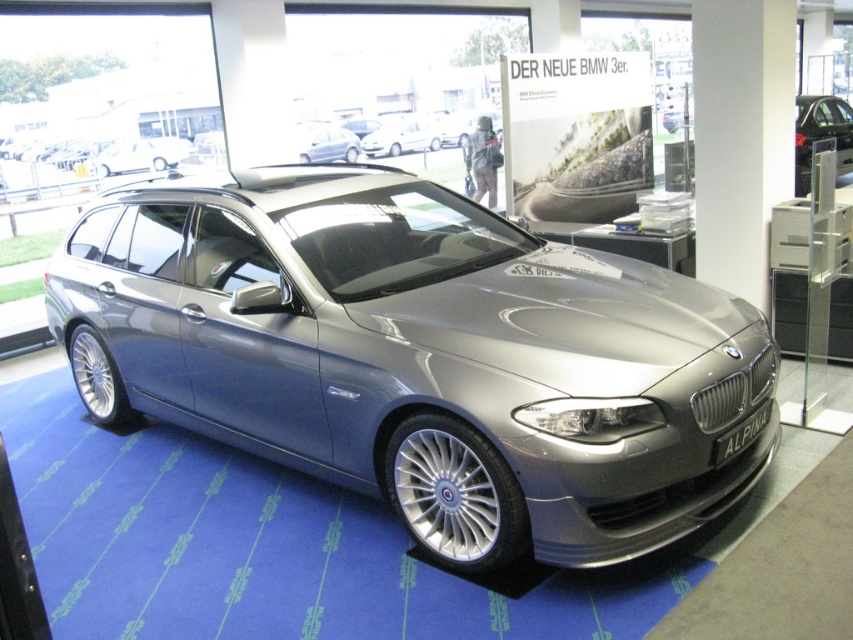
Question: Is white glossy car at center bigger than white glossy hatchback at center?

Choices:
 (A) no
 (B) yes

Answer: (A)

Question: Observing the image, what is the correct spatial positioning of blue carpet at center in reference to satin silver car at upper right?

Choices:
 (A) right
 (B) left

Answer: (B)

Question: Which point is farther from the camera taking this photo?

Choices:
 (A) (111, 173)
 (B) (323, 156)
 (C) (422, 145)

Answer: (C)

Question: Considering the real-world distances, which object is closest to the white glossy car at center?

Choices:
 (A) satin silver metallic car at upper center
 (B) white glossy hatchback at center

Answer: (A)

Question: Considering the relative positions of blue carpet at center and satin silver metallic car at upper center in the image provided, where is blue carpet at center located with respect to satin silver metallic car at upper center?

Choices:
 (A) left
 (B) right

Answer: (B)

Question: Which point is closer to the camera?

Choices:
 (A) satin silver car at upper right
 (B) white glossy hatchback at center
 (C) satin silver metallic car at upper center

Answer: (A)